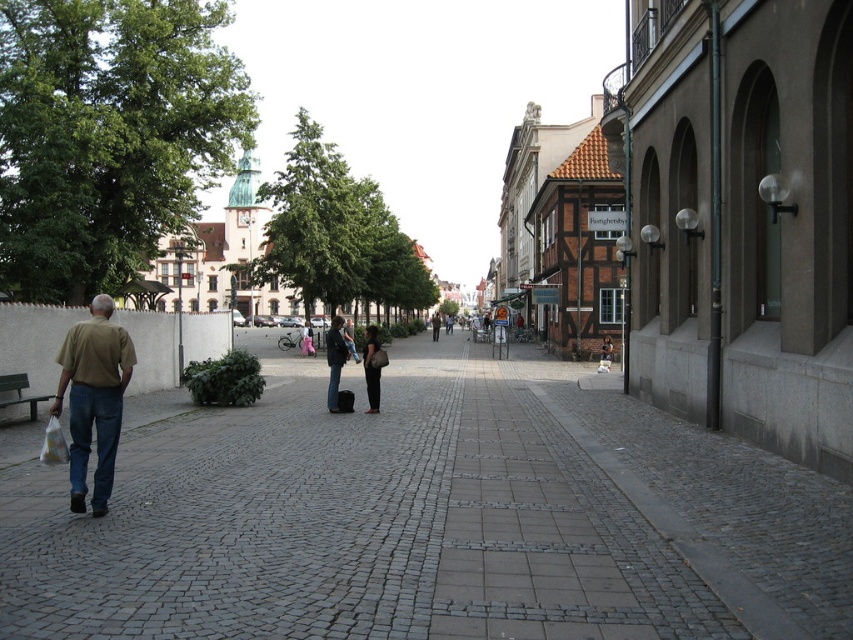
Describe the element at coordinates (432, 518) in the screenshot. I see `gray cobblestone pavement at center` at that location.

Does gray cobblestone pavement at center appear on the left side of dark gray fabric bag at center?

In fact, gray cobblestone pavement at center is to the right of dark gray fabric bag at center.

Is point (68, 563) in front of point (373, 376)?

Yes, it is in front of point (373, 376).

Identify the location of gray cobblestone pavement at center. (432, 518).

Can you confirm if matte black suitcase at center is positioned to the right of dark blue jeans at center?

Correct, you'll find matte black suitcase at center to the right of dark blue jeans at center.

Is point (374, 332) positioned behind point (334, 369)?

Yes, point (374, 332) is farther from viewer.

The width and height of the screenshot is (853, 640). In order to click on matte black suitcase at center in this screenshot , I will do `click(335, 362)`.

Can you confirm if matte black suitcase at center is smaller than dark gray fabric bag at center?

No.

Between point (375, 340) and point (366, 340), which one is positioned behind?

Positioned behind is point (366, 340).

Measure the distance between matte black suitcase at center and camera.

They are 48.73 feet apart.

Find the location of `matte black suitcase at center`. matte black suitcase at center is located at coordinates (335, 362).